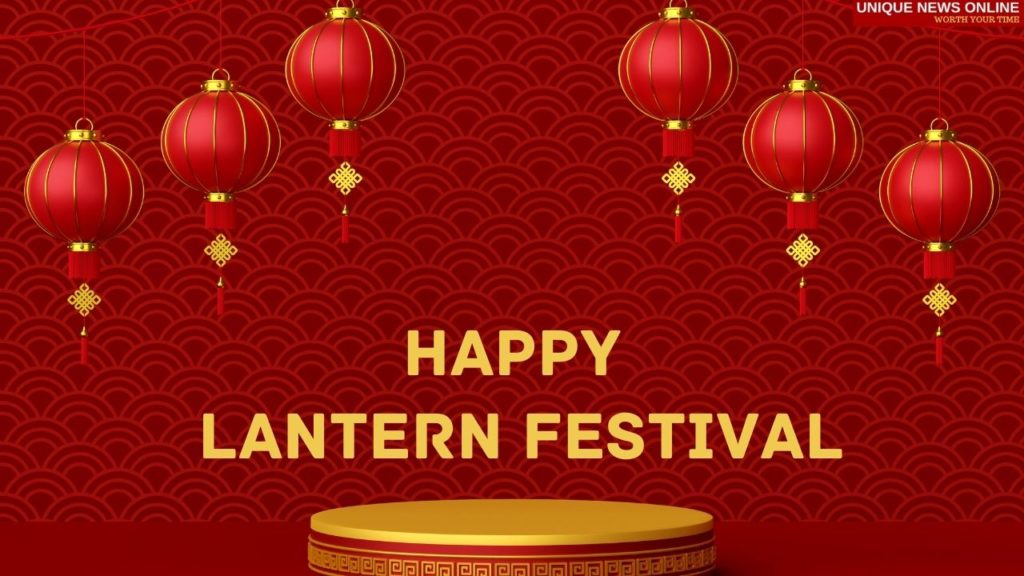
This screenshot has width=1024, height=576. I want to click on table, so click(x=484, y=520).